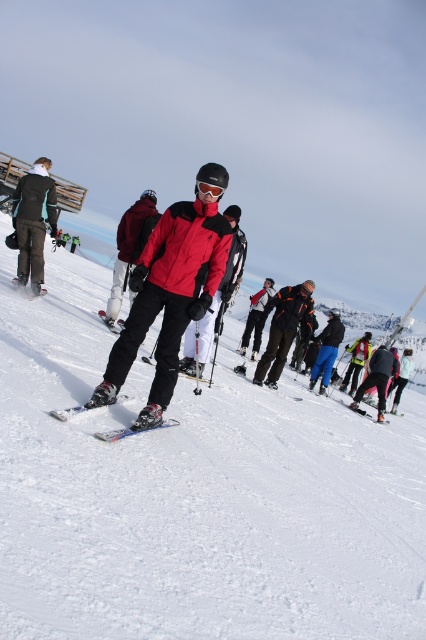
You are a photographer trying to capture the person in the matte red jacket at center. You want to ensure the white powdery snow at center is visible in the background. Based on their positions, is the snow to the left or right of the jacket?

The white powdery snow at center is to the left of the matte red jacket at center, so the snow will be visible to the left side of the jacket in the photo.

You are a beginner skier who wants to ensure your equipment is safe before starting. You have a matte black ski at lower left and see white powdery snow at center. Which object is higher in elevation?

The white powdery snow at center has a greater height compared to the matte black ski at lower left, so the white powdery snow at center is higher in elevation.